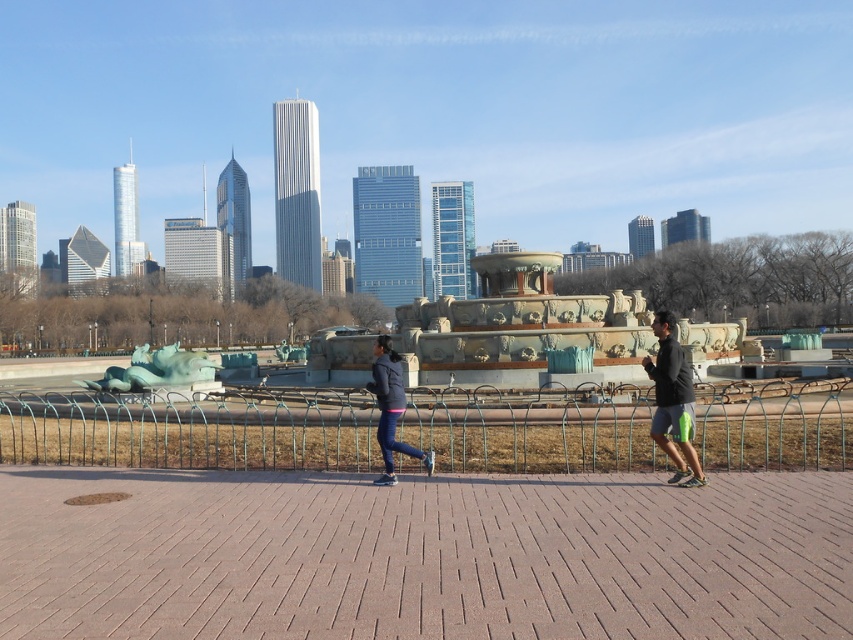
Is dark gray fabric jacket at right to the left of matte black jacket at center from the viewer's perspective?

In fact, dark gray fabric jacket at right is to the right of matte black jacket at center.

Which is behind, point (659, 360) or point (389, 472)?

The point (389, 472) is behind.

Find the location of a particular element. dark gray fabric jacket at right is located at coordinates (672, 401).

Is green metal fence at center shorter than matte black jacket at center?

Yes, green metal fence at center is shorter than matte black jacket at center.

Is point (560, 406) positioned before point (390, 424)?

No.

Who is more forward, (x=306, y=449) or (x=384, y=360)?

Point (x=384, y=360) is more forward.

Locate an element on the screen. This screenshot has height=640, width=853. green metal fence at center is located at coordinates (192, 429).

Can you confirm if green metal fence at center is smaller than dark gray fabric jacket at right?

Actually, green metal fence at center might be larger than dark gray fabric jacket at right.

Who is more forward, (477, 429) or (660, 380)?

Point (660, 380) is in front.

Where is `green metal fence at center`? green metal fence at center is located at coordinates [x=192, y=429].